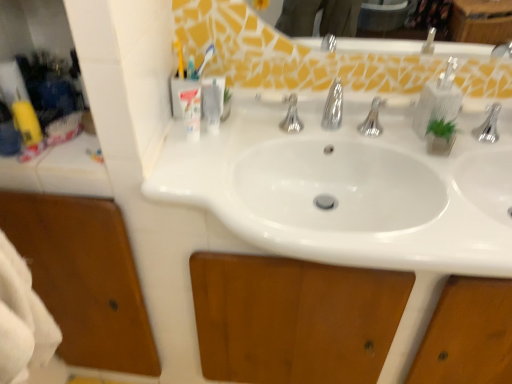
In order to click on clear plastic soap dispenser at upper right in this screenshot , I will do `click(438, 100)`.

Image resolution: width=512 pixels, height=384 pixels. What do you see at coordinates (213, 102) in the screenshot?
I see `clear plastic soap dispenser at upper center, placed as the first toiletry when sorted from right to left` at bounding box center [213, 102].

What do you see at coordinates (204, 61) in the screenshot?
I see `translucent plastic toothbrush at upper center` at bounding box center [204, 61].

Identify the location of clear plastic soap dispenser at upper right. The height and width of the screenshot is (384, 512). (438, 100).

Which of these two, clear plastic soap dispenser at upper right or clear plastic soap dispenser at upper center, placed as the first toiletry when sorted from right to left, stands shorter?

Result: Standing shorter between the two is clear plastic soap dispenser at upper center, placed as the first toiletry when sorted from right to left.

From a real-world perspective, is clear plastic soap dispenser at upper right physically located above or below clear plastic soap dispenser at upper center, the 2th toiletry positioned from the left?

clear plastic soap dispenser at upper right is situated higher than clear plastic soap dispenser at upper center, the 2th toiletry positioned from the left, in the real world.

Is clear plastic soap dispenser at upper right smaller than clear plastic soap dispenser at upper center, the 2th toiletry positioned from the left?

No, clear plastic soap dispenser at upper right is not smaller than clear plastic soap dispenser at upper center, the 2th toiletry positioned from the left.

Considering the sizes of objects clear plastic soap dispenser at upper center, placed as the first toiletry when sorted from right to left, and translucent plastic toothbrush holder at upper left, the 1th toiletry viewed from the left, in the image provided, who is thinner, clear plastic soap dispenser at upper center, placed as the first toiletry when sorted from right to left, or translucent plastic toothbrush holder at upper left, the 1th toiletry viewed from the left,?

With smaller width is clear plastic soap dispenser at upper center, placed as the first toiletry when sorted from right to left.

Based on the photo, is clear plastic soap dispenser at upper center, the 2th toiletry positioned from the left, placed right next to translucent plastic toothbrush holder at upper left, the 1th toiletry viewed from the left?

Yes, clear plastic soap dispenser at upper center, the 2th toiletry positioned from the left, is next to translucent plastic toothbrush holder at upper left, the 1th toiletry viewed from the left.

Is clear plastic soap dispenser at upper center, placed as the first toiletry when sorted from right to left, further to the viewer compared to translucent plastic toothbrush holder at upper left, acting as the second toiletry starting from the right?

Yes, it is.

The width and height of the screenshot is (512, 384). What are the coordinates of `toiletry below the clear plastic soap dispenser at upper center, placed as the first toiletry when sorted from right to left (from the image's perspective)` in the screenshot? It's located at (191, 112).

Between clear plastic soap dispenser at upper right and translucent plastic toothbrush holder at upper left, the 1th toiletry viewed from the left, which one has larger size?

clear plastic soap dispenser at upper right is bigger.

Is translucent plastic toothbrush holder at upper left, acting as the second toiletry starting from the right, at the back of clear plastic soap dispenser at upper right?

That's not correct — clear plastic soap dispenser at upper right is not looking away from translucent plastic toothbrush holder at upper left, acting as the second toiletry starting from the right.

Between clear plastic soap dispenser at upper right and translucent plastic toothbrush holder at upper left, acting as the second toiletry starting from the right, which one has larger width?

Wider between the two is clear plastic soap dispenser at upper right.

From a real-world perspective, which is physically below, clear plastic soap dispenser at upper right or translucent plastic toothbrush holder at upper left, the 1th toiletry viewed from the left?

translucent plastic toothbrush holder at upper left, the 1th toiletry viewed from the left, from a real-world perspective.

Is clear plastic soap dispenser at upper center, placed as the first toiletry when sorted from right to left, to the left or to the right of translucent plastic toothbrush at upper center in the image?

Based on their positions, clear plastic soap dispenser at upper center, placed as the first toiletry when sorted from right to left, is located to the right of translucent plastic toothbrush at upper center.

Measure the distance from clear plastic soap dispenser at upper center, placed as the first toiletry when sorted from right to left, to translucent plastic toothbrush at upper center.

clear plastic soap dispenser at upper center, placed as the first toiletry when sorted from right to left, is 4.15 inches from translucent plastic toothbrush at upper center.

Does point (208, 122) lie in front of point (205, 64)?

Yes, it is.

Is clear plastic soap dispenser at upper center, placed as the first toiletry when sorted from right to left, surrounding translucent plastic toothbrush at upper center?

No, clear plastic soap dispenser at upper center, placed as the first toiletry when sorted from right to left, does not contain translucent plastic toothbrush at upper center.

Considering the sizes of objects translucent plastic toothbrush at upper center and clear plastic soap dispenser at upper right in the image provided, who is thinner, translucent plastic toothbrush at upper center or clear plastic soap dispenser at upper right?

Thinner between the two is translucent plastic toothbrush at upper center.

Between point (206, 57) and point (442, 117), which one is positioned behind?

The point (206, 57) is farther.

Would you say translucent plastic toothbrush at upper center contains clear plastic soap dispenser at upper right?

No, clear plastic soap dispenser at upper right is not inside translucent plastic toothbrush at upper center.

From the image's perspective, which is below, translucent plastic toothbrush at upper center or translucent plastic toothbrush holder at upper left, acting as the second toiletry starting from the right?

translucent plastic toothbrush holder at upper left, acting as the second toiletry starting from the right, is shown below in the image.

Which object is closer to the camera taking this photo, translucent plastic toothbrush at upper center or translucent plastic toothbrush holder at upper left, acting as the second toiletry starting from the right?

translucent plastic toothbrush holder at upper left, acting as the second toiletry starting from the right, is closer to the camera.

Is translucent plastic toothbrush at upper center not close to translucent plastic toothbrush holder at upper left, acting as the second toiletry starting from the right?

No, translucent plastic toothbrush at upper center is not far away from translucent plastic toothbrush holder at upper left, acting as the second toiletry starting from the right.

Where is `toothbrush above the translucent plastic toothbrush holder at upper left, the 1th toiletry viewed from the left (from a real-world perspective)`? Image resolution: width=512 pixels, height=384 pixels. toothbrush above the translucent plastic toothbrush holder at upper left, the 1th toiletry viewed from the left (from a real-world perspective) is located at coordinates (204, 61).

Looking at this image, in terms of width, does translucent plastic toothbrush at upper center look wider or thinner when compared to clear plastic soap dispenser at upper center, the 2th toiletry positioned from the left?

In the image, translucent plastic toothbrush at upper center appears to be wider than clear plastic soap dispenser at upper center, the 2th toiletry positioned from the left.

Based on the photo, is translucent plastic toothbrush at upper center closer to the viewer compared to clear plastic soap dispenser at upper center, placed as the first toiletry when sorted from right to left?

No.

From the image's perspective, relative to clear plastic soap dispenser at upper center, placed as the first toiletry when sorted from right to left, is translucent plastic toothbrush at upper center above or below?

translucent plastic toothbrush at upper center is situated higher than clear plastic soap dispenser at upper center, placed as the first toiletry when sorted from right to left, in the image.

There is a clear plastic soap dispenser at upper right. Where is `the 1st toiletry below it (from a real-world perspective)`? The width and height of the screenshot is (512, 384). the 1st toiletry below it (from a real-world perspective) is located at coordinates (213, 102).

The height and width of the screenshot is (384, 512). Identify the location of toiletry on the right of translucent plastic toothbrush holder at upper left, acting as the second toiletry starting from the right. (213, 102).

From the image, which object appears to be nearer to clear plastic soap dispenser at upper right, translucent plastic toothbrush at upper center or clear plastic soap dispenser at upper center, placed as the first toiletry when sorted from right to left?

The object closer to clear plastic soap dispenser at upper right is clear plastic soap dispenser at upper center, placed as the first toiletry when sorted from right to left.

Based on their spatial positions, is clear plastic soap dispenser at upper right or clear plastic soap dispenser at upper center, placed as the first toiletry when sorted from right to left, closer to translucent plastic toothbrush at upper center?

Based on the image, clear plastic soap dispenser at upper center, placed as the first toiletry when sorted from right to left, appears to be nearer to translucent plastic toothbrush at upper center.

Based on their spatial positions, is clear plastic soap dispenser at upper right or translucent plastic toothbrush holder at upper left, the 1th toiletry viewed from the left, further from clear plastic soap dispenser at upper center, the 2th toiletry positioned from the left?

Based on the image, clear plastic soap dispenser at upper right appears to be further to clear plastic soap dispenser at upper center, the 2th toiletry positioned from the left.

Looking at the image, which one is located further to translucent plastic toothbrush at upper center, translucent plastic toothbrush holder at upper left, acting as the second toiletry starting from the right, or clear plastic soap dispenser at upper center, the 2th toiletry positioned from the left?

translucent plastic toothbrush holder at upper left, acting as the second toiletry starting from the right.

When comparing their distances from clear plastic soap dispenser at upper center, the 2th toiletry positioned from the left, does translucent plastic toothbrush at upper center or translucent plastic toothbrush holder at upper left, acting as the second toiletry starting from the right, seem closer?

Based on the image, translucent plastic toothbrush holder at upper left, acting as the second toiletry starting from the right, appears to be nearer to clear plastic soap dispenser at upper center, the 2th toiletry positioned from the left.

Based on their spatial positions, is clear plastic soap dispenser at upper center, placed as the first toiletry when sorted from right to left, or translucent plastic toothbrush holder at upper left, acting as the second toiletry starting from the right, further from translucent plastic toothbrush at upper center?

translucent plastic toothbrush holder at upper left, acting as the second toiletry starting from the right, is further to translucent plastic toothbrush at upper center.

When comparing their distances from clear plastic soap dispenser at upper right, does clear plastic soap dispenser at upper center, placed as the first toiletry when sorted from right to left, or translucent plastic toothbrush holder at upper left, the 1th toiletry viewed from the left, seem further?

translucent plastic toothbrush holder at upper left, the 1th toiletry viewed from the left, is positioned further to the anchor clear plastic soap dispenser at upper right.

Looking at the image, which one is located closer to translucent plastic toothbrush at upper center, clear plastic soap dispenser at upper right or translucent plastic toothbrush holder at upper left, the 1th toiletry viewed from the left?

translucent plastic toothbrush holder at upper left, the 1th toiletry viewed from the left.

Where is `toiletry located between translucent plastic toothbrush at upper center and clear plastic soap dispenser at upper right in the left-right direction`? Image resolution: width=512 pixels, height=384 pixels. toiletry located between translucent plastic toothbrush at upper center and clear plastic soap dispenser at upper right in the left-right direction is located at coordinates (213, 102).

You are a GUI agent. You are given a task and a screenshot of the screen. Output one action in this format:
    pyautogui.click(x=<x>, y=<y>)
    Task: Click on the toothbrush between translucent plastic toothbrush holder at upper left, the 1th toiletry viewed from the left, and clear plastic soap dispenser at upper right from left to right
    
    Given the screenshot: What is the action you would take?
    pyautogui.click(x=204, y=61)

This screenshot has height=384, width=512. I want to click on toiletry situated between translucent plastic toothbrush holder at upper left, the 1th toiletry viewed from the left, and clear plastic soap dispenser at upper right from left to right, so click(213, 102).

This screenshot has width=512, height=384. What are the coordinates of `toiletry between translucent plastic toothbrush at upper center and translucent plastic toothbrush holder at upper left, the 1th toiletry viewed from the left, in the vertical direction` in the screenshot? It's located at (213, 102).